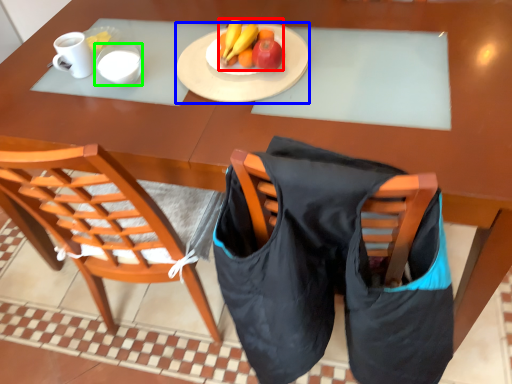
Question: Considering the real-world distances, which object is closest to banana (highlighted by a red box)? plate (highlighted by a blue box) or mug (highlighted by a green box).

Choices:
 (A) plate
 (B) mug

Answer: (A)